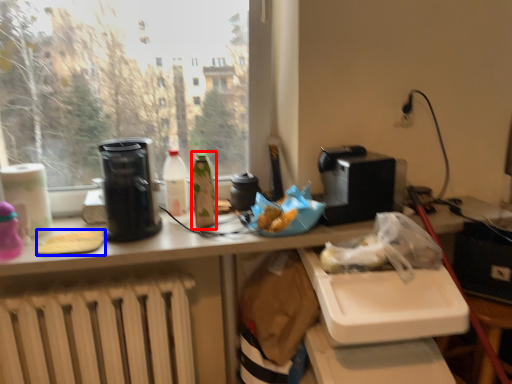
Question: Among these objects, which one is farthest to the camera, bottle (highlighted by a red box) or food (highlighted by a blue box)?

Choices:
 (A) bottle
 (B) food

Answer: (A)